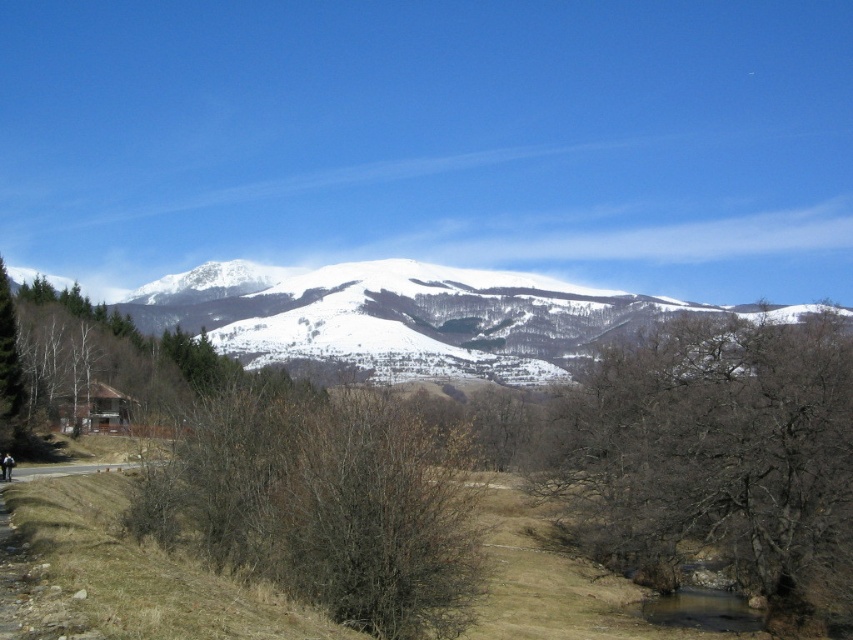
Question: Which of the following is the closest to the observer?

Choices:
 (A) brown leafless tree at center
 (B) white snow-covered mountain at upper center

Answer: (A)

Question: Among these objects, which one is farthest from the camera?

Choices:
 (A) brown leafless tree at center
 (B) white snow-covered mountain at upper center
 (C) brown/dry wood at center

Answer: (B)

Question: Is brown leafless tree at center in front of white snow-covered mountain at upper center?

Choices:
 (A) yes
 (B) no

Answer: (A)

Question: Does brown leafless tree at center appear on the left side of white snow-covered mountain at upper center?

Choices:
 (A) no
 (B) yes

Answer: (B)

Question: Does brown leafless tree at center have a lesser width compared to white snow-covered mountain at upper center?

Choices:
 (A) no
 (B) yes

Answer: (B)

Question: Which object is the closest to the brown leafless tree at center?

Choices:
 (A) white snow-covered mountain at upper center
 (B) brown/dry wood at center

Answer: (B)